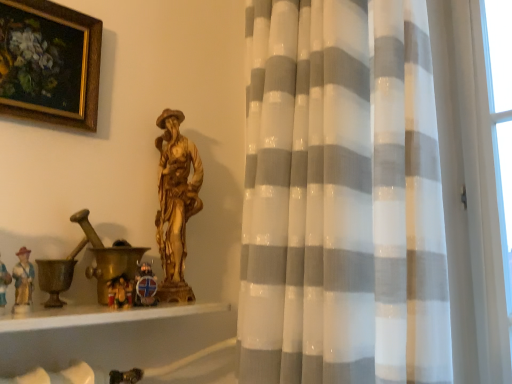
Measure the distance between white glossy wood at lower left and camera.

26.54 inches.

The width and height of the screenshot is (512, 384). Identify the location of gold-framed painting at upper left. (49, 63).

The height and width of the screenshot is (384, 512). What do you see at coordinates (49, 63) in the screenshot?
I see `gold-framed painting at upper left` at bounding box center [49, 63].

This screenshot has height=384, width=512. Identify the location of white glossy wood at lower left. (99, 315).

Is gold-framed painting at upper left not near white glossy wood at lower left?

No, gold-framed painting at upper left is not far from white glossy wood at lower left.

Looking at this image, could you tell me if gold-framed painting at upper left is turned towards white glossy wood at lower left?

No, gold-framed painting at upper left is not facing towards white glossy wood at lower left.

Consider the image. Does gold-framed painting at upper left have a smaller size compared to white glossy wood at lower left?

Yes.

Looking at this image, is gold-framed painting at upper left not inside white glossy wood at lower left?

Absolutely, gold-framed painting at upper left is external to white glossy wood at lower left.

Can you confirm if gold-framed painting at upper left is positioned to the right of white sheer curtain at center?

Incorrect, gold-framed painting at upper left is not on the right side of white sheer curtain at center.

Identify the location of curtain below the gold-framed painting at upper left (from a real-world perspective). The height and width of the screenshot is (384, 512). (367, 197).

Which of these two, gold-framed painting at upper left or white sheer curtain at center, is smaller?

gold-framed painting at upper left.

Considering the relative sizes of white sheer curtain at center and gold-framed painting at upper left in the image provided, is white sheer curtain at center bigger than gold-framed painting at upper left?

Yes, white sheer curtain at center is bigger than gold-framed painting at upper left.

Who is more distant, white sheer curtain at center or gold-framed painting at upper left?

gold-framed painting at upper left is further away from the camera.

Considering the sizes of objects white sheer curtain at center and gold-framed painting at upper left in the image provided, who is wider, white sheer curtain at center or gold-framed painting at upper left?

Wider between the two is white sheer curtain at center.

From the image's perspective, which is above, white sheer curtain at center or gold-framed painting at upper left?

gold-framed painting at upper left appears higher in the image.

Does white glossy wood at lower left contain white sheer curtain at center?

No, white sheer curtain at center is not inside white glossy wood at lower left.

Does white glossy wood at lower left have a lesser width compared to white sheer curtain at center?

Yes.

From the image's perspective, which object appears higher, white glossy wood at lower left or white sheer curtain at center?

white sheer curtain at center is shown above in the image.

Based on the photo, from a real-world perspective, between white sheer curtain at center and white glossy wood at lower left, who is vertically lower?

white glossy wood at lower left.

Is white sheer curtain at center not near white glossy wood at lower left?

white sheer curtain at center is near white glossy wood at lower left, not far away.

From the image's perspective, which one is positioned lower, white sheer curtain at center or white glossy wood at lower left?

From the image's view, white glossy wood at lower left is below.

Which object is positioned more to the right, white sheer curtain at center or white glossy wood at lower left?

From the viewer's perspective, white sheer curtain at center appears more on the right side.

From the image's perspective, is white glossy wood at lower left located above or below gold-framed painting at upper left?

Clearly, from the image's perspective, white glossy wood at lower left is below gold-framed painting at upper left.

From a real-world perspective, is white glossy wood at lower left over gold-framed painting at upper left?

No, from a real-world perspective, white glossy wood at lower left is not on top of gold-framed painting at upper left.

Which object is thinner, white glossy wood at lower left or gold-framed painting at upper left?

With smaller width is gold-framed painting at upper left.

This screenshot has width=512, height=384. I want to click on window sill below the gold-framed painting at upper left (from a real-world perspective), so click(x=99, y=315).

You are a GUI agent. You are given a task and a screenshot of the screen. Output one action in this format:
    pyautogui.click(x=<x>, y=<y>)
    Task: Click on the curtain below the gold-framed painting at upper left (from the image's perspective)
    
    Given the screenshot: What is the action you would take?
    pyautogui.click(x=367, y=197)

When comparing their distances from white glossy wood at lower left, does gold-framed painting at upper left or white sheer curtain at center seem closer?

white sheer curtain at center lies closer to white glossy wood at lower left than the other object.

Which object lies nearer to the anchor point white sheer curtain at center, gold-framed painting at upper left or white glossy wood at lower left?

Among the two, white glossy wood at lower left is located nearer to white sheer curtain at center.

Based on their spatial positions, is white glossy wood at lower left or white sheer curtain at center further from gold-framed painting at upper left?

white sheer curtain at center is further to gold-framed painting at upper left.

In the scene shown: From the image, which object appears to be farther from gold-framed painting at upper left, white sheer curtain at center or white glossy wood at lower left?

Based on the image, white sheer curtain at center appears to be further to gold-framed painting at upper left.

When comparing their distances from white glossy wood at lower left, does white sheer curtain at center or gold-framed painting at upper left seem further?

Among the two, gold-framed painting at upper left is located further to white glossy wood at lower left.

Looking at the image, which one is located closer to white sheer curtain at center, white glossy wood at lower left or gold-framed painting at upper left?

white glossy wood at lower left.

The image size is (512, 384). I want to click on window sill located between gold-framed painting at upper left and white sheer curtain at center in the left-right direction, so click(x=99, y=315).